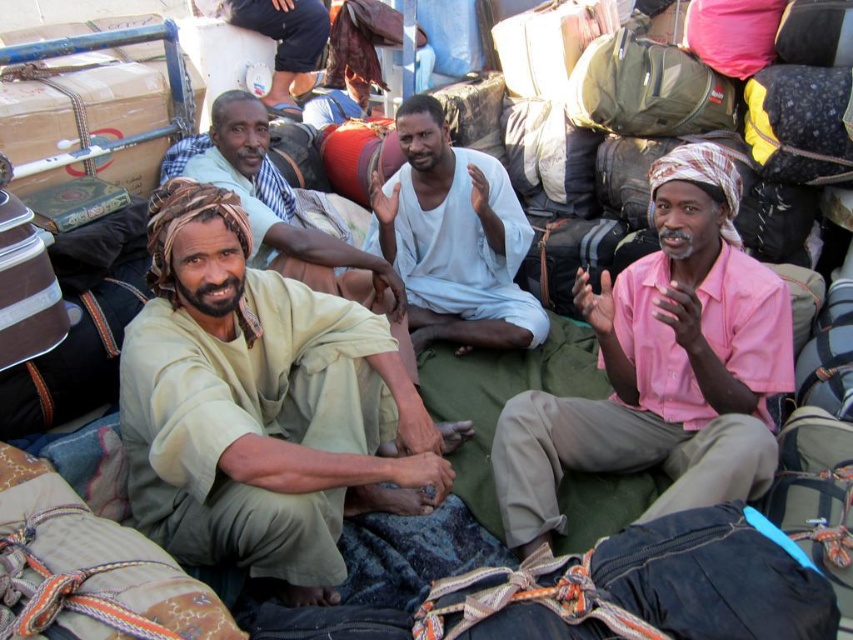
You are a photographer trying to capture a group photo of the beige fabric at center and the pink cotton shirt at center. Which object should you focus on first if you want to ensure both are in focus, considering their heights?

The beige fabric at center has a lesser height compared to the pink cotton shirt at center. To ensure both are in focus, focus on the pink cotton shirt at center first since it is taller and will require more precise focusing to capture details.

You are a photographer trying to capture a detailed shot of both the beige fabric at center and the pink cotton shirt at center. Since you can only focus on one object at a time, which one should you choose to ensure the other remains in the background without being too blurry?

The beige fabric at center is larger in size than the pink cotton shirt at center, so focusing on the beige fabric at center would keep the pink cotton shirt at center in the background with less blur due to its smaller size and distance.